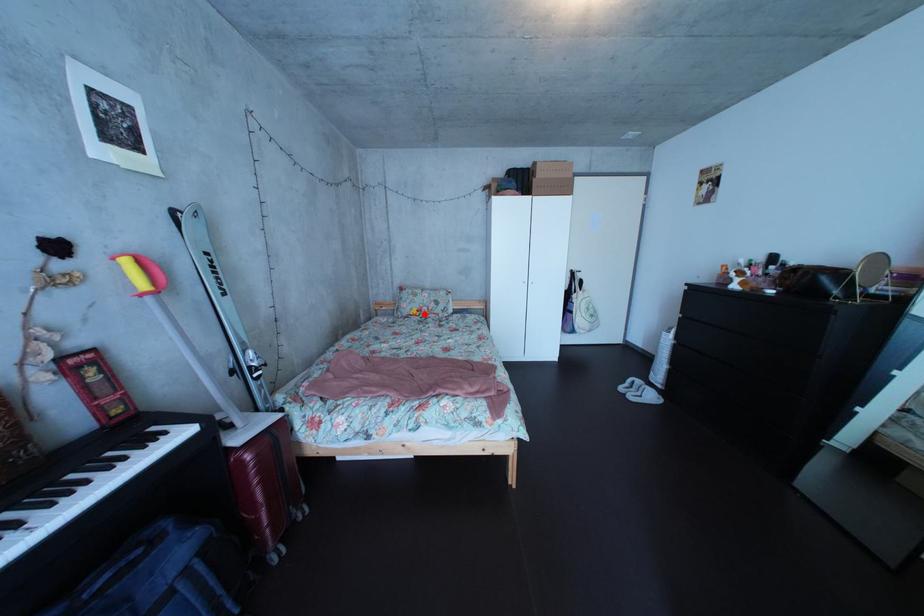
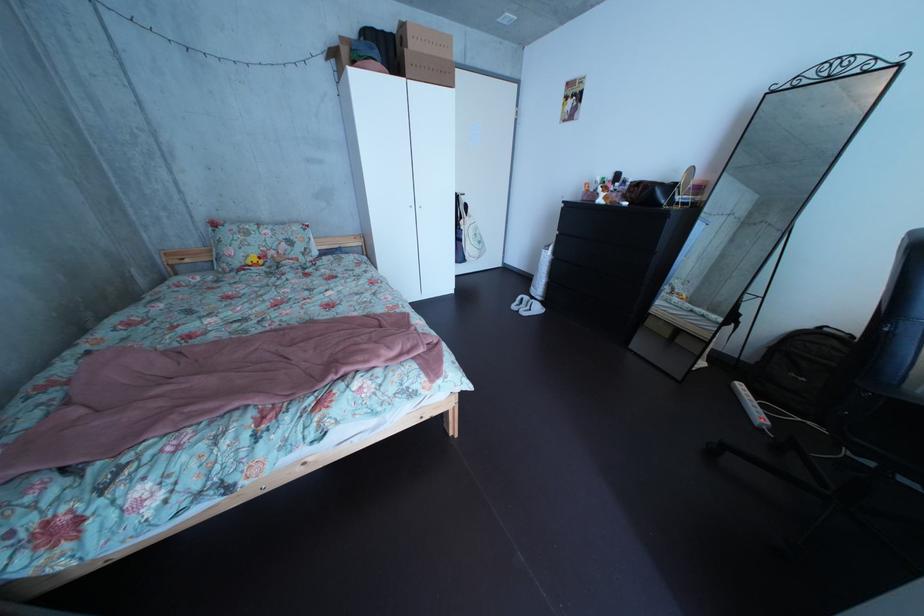
In the second image, find the point that corresponds to the highlighted location in the first image.

(256, 260)